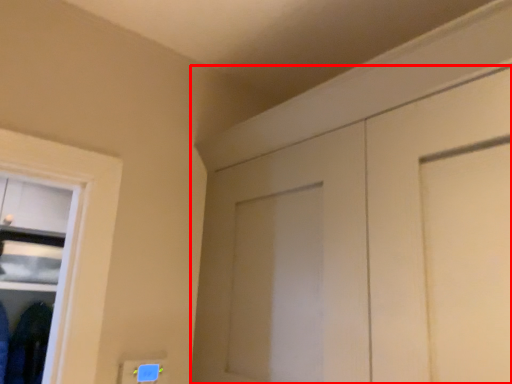
Question: From the image's perspective, what is the correct spatial positioning of door (annotated by the red box) in reference to clothing?

Choices:
 (A) below
 (B) above

Answer: (B)